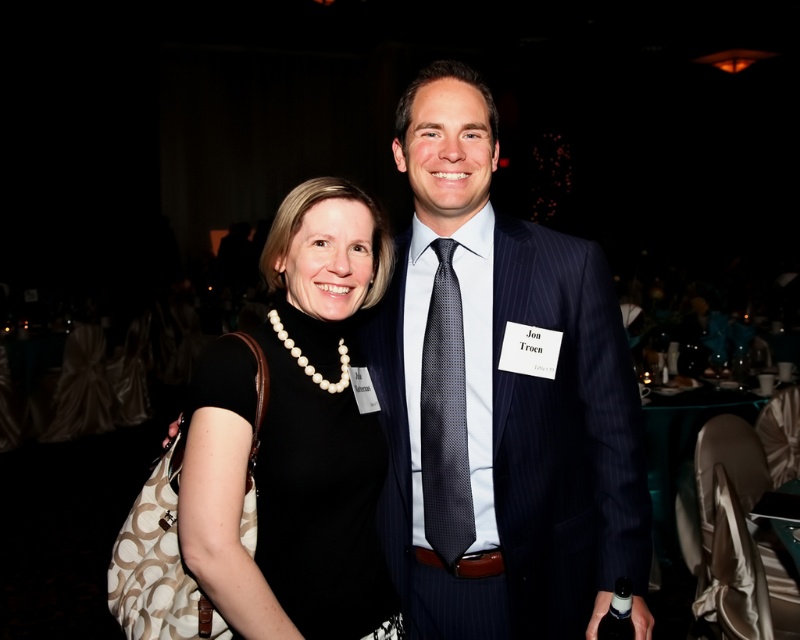
You are a photographer at the event and need to adjust the lighting to focus on the dark blue pinstripe suit at center and the black dotted tie at center. Since the background is dimly lit, which object should you adjust the lighting for first to ensure it appears properly illuminated in the photo?

The dark blue pinstripe suit at center is in front of the black dotted tie at center, so you should adjust the lighting for the dark blue pinstripe suit at center first to ensure it is properly illuminated before the black dotted tie at center.

You are a photographer at a formal event. You need to adjust the lighting so that the black matte dress at center is more visible than the black dotted tie at center. Based on their positions, which object should you focus the light on?

The black matte dress at center is in front of the black dotted tie at center. Therefore, focusing the light on the black matte dress at center will make it more visible since it is closer to the camera.